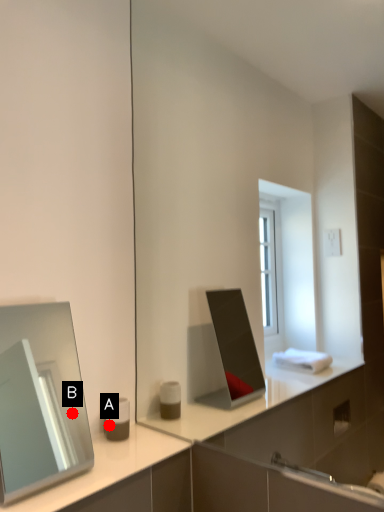
Question: Two points are circled on the image, labeled by A and B beside each circle. Which of the following is the closest to the observer?

Choices:
 (A) A is closer
 (B) B is closer

Answer: (A)